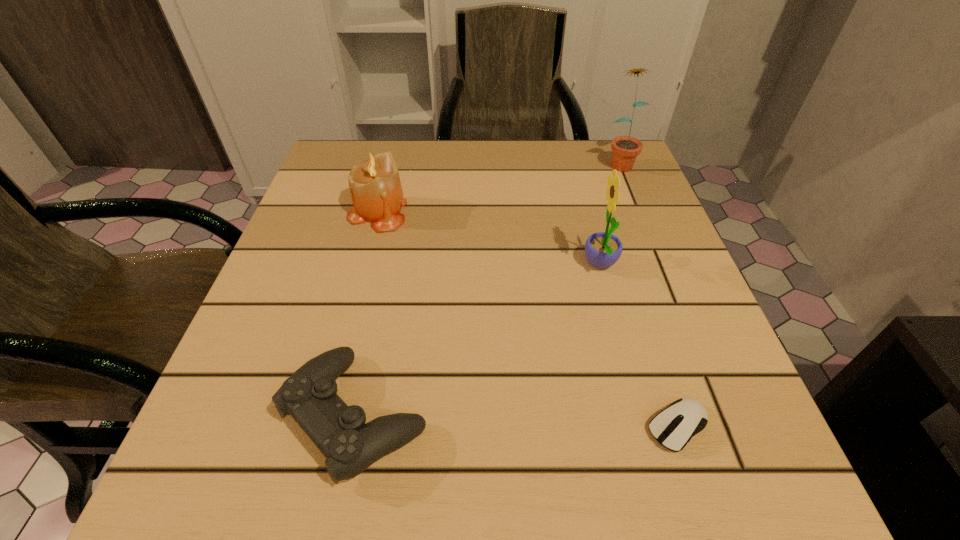
This screenshot has width=960, height=540. I want to click on vacant space at the far right corner of the desktop, so click(x=638, y=165).

Locate an element on the screen. This screenshot has height=540, width=960. free space at the near right corner is located at coordinates (779, 488).

The image size is (960, 540). Find the location of `vacant area between the farthest object and the third shortest object`. vacant area between the farthest object and the third shortest object is located at coordinates (498, 187).

This screenshot has width=960, height=540. I want to click on free area in between the fourth tallest object and the farthest object, so click(487, 288).

At what (x,y) coordinates should I click in order to perform the action: click on free spot between the shortest object and the control. Please return your answer as a coordinate pair (x, y). Image resolution: width=960 pixels, height=540 pixels. Looking at the image, I should click on (516, 421).

Image resolution: width=960 pixels, height=540 pixels. In order to click on vacant area between the third farthest object and the farther sunflower in this screenshot , I will do `click(610, 213)`.

Where is `vacant space in between the fourth tallest object and the left sunflower`? This screenshot has width=960, height=540. vacant space in between the fourth tallest object and the left sunflower is located at coordinates (478, 340).

This screenshot has width=960, height=540. I want to click on vacant space that is in between the shortest object and the third nearest object, so click(639, 346).

The height and width of the screenshot is (540, 960). Identify the location of free point between the mouse and the left sunflower. (639, 346).

Locate an element on the screen. The image size is (960, 540). empty location between the fourth nearest object and the shortest object is located at coordinates (528, 319).